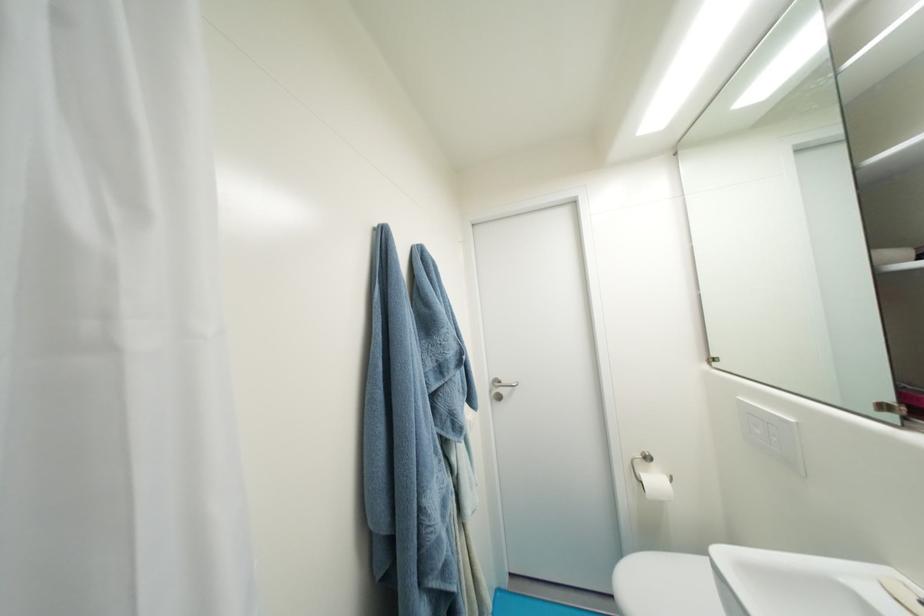
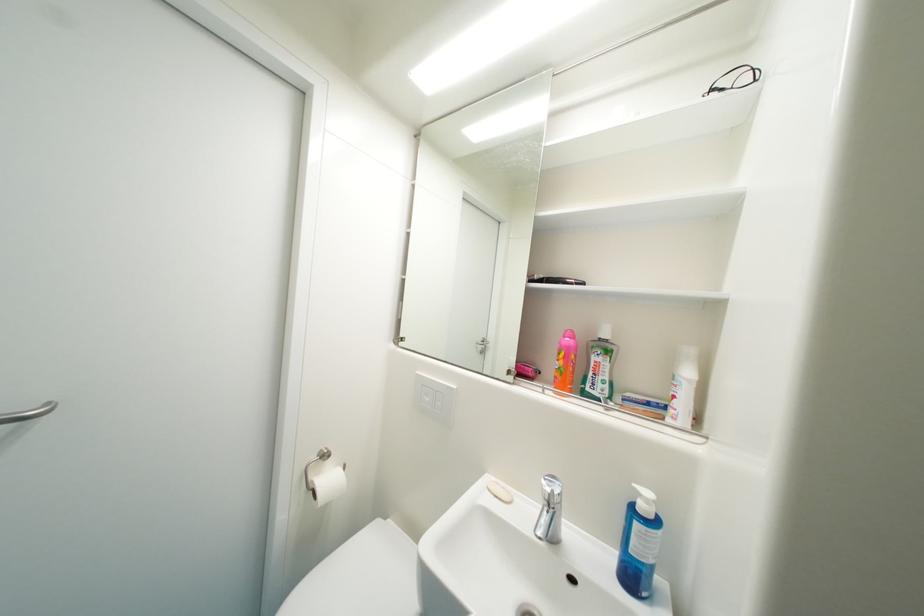
Question: The camera is either moving clockwise (left) or counter-clockwise (right) around the object. The first image is from the beginning of the video and the second image is from the end. Is the camera moving left or right when shooting the video?

Choices:
 (A) Left
 (B) Right

Answer: (A)